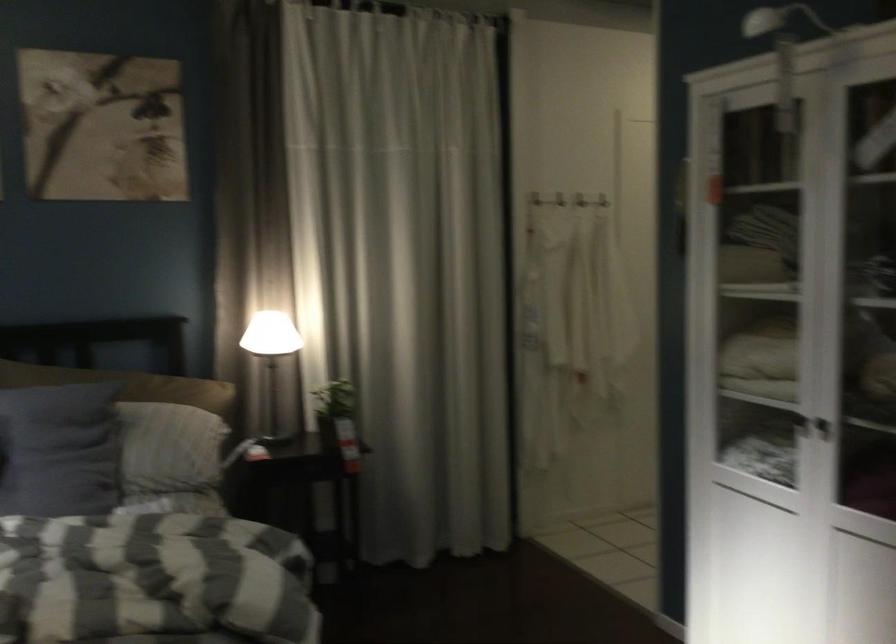
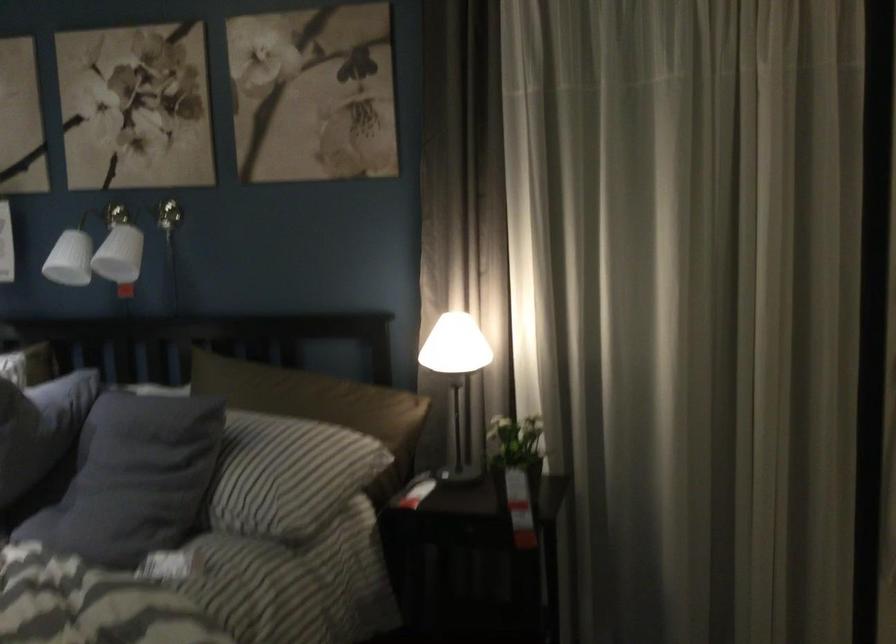
Locate, in the second image, the point that corresponds to point (341, 404) in the first image.

(515, 451)